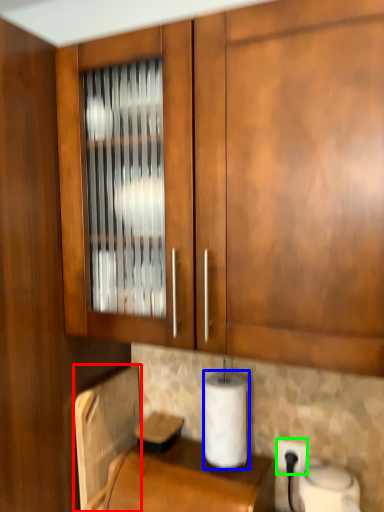
Question: Based on their relative distances, which object is nearer to appliance (highlighted by a red box)? Choose from paper towel (highlighted by a blue box) and electric outlet (highlighted by a green box).

Choices:
 (A) paper towel
 (B) electric outlet

Answer: (A)